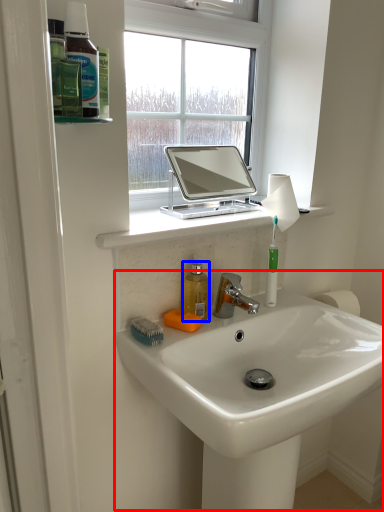
Question: Which of the following is the farthest to the observer, sink (highlighted by a red box) or mouthwash (highlighted by a blue box)?

Choices:
 (A) sink
 (B) mouthwash

Answer: (B)